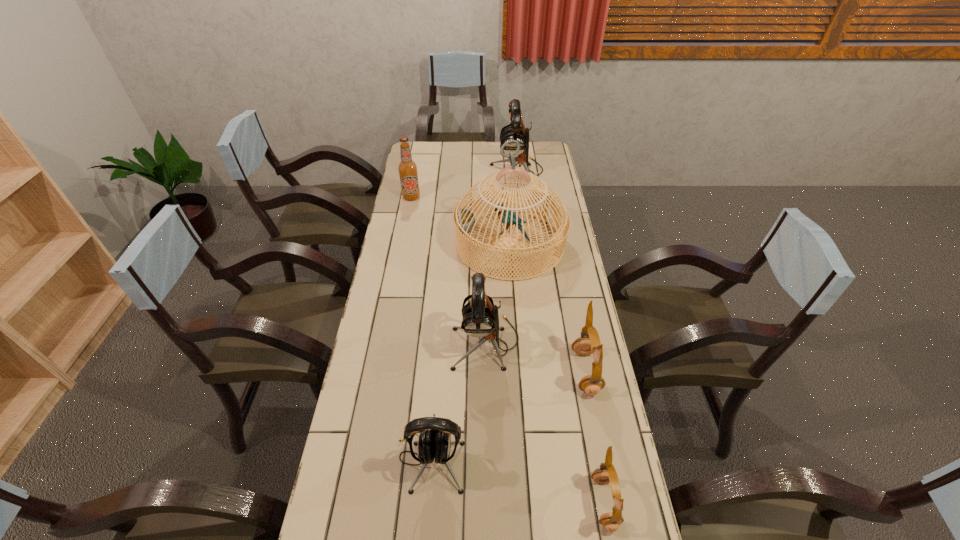
You are a GUI agent. You are given a task and a screenshot of the screen. Output one action in this format:
    pyautogui.click(x=<x>, y=<y>)
    Task: Click on the fifth nearest object
    This screenshot has height=540, width=960.
    Given the screenshot: What is the action you would take?
    pyautogui.click(x=464, y=220)

Locate an element on the screen. This screenshot has width=960, height=540. the tallest object is located at coordinates (464, 220).

At what (x,y) coordinates should I click in order to perform the action: click on the farthest earphone. Please return your answer as a coordinate pair (x, y). Looking at the image, I should click on (515, 130).

Locate an element on the screen. This screenshot has height=540, width=960. the farthest black earphone is located at coordinates (515, 130).

Where is `the second farthest black earphone`? The height and width of the screenshot is (540, 960). the second farthest black earphone is located at coordinates (480, 316).

The image size is (960, 540). Identify the location of the second tallest earphone. (480, 316).

Locate an element on the screen. The image size is (960, 540). the leftmost object is located at coordinates (407, 168).

The image size is (960, 540). I want to click on beer bottle, so click(x=407, y=168).

The height and width of the screenshot is (540, 960). I want to click on the bigger brown earphone, so click(589, 342).

Locate an element on the screen. the smallest black earphone is located at coordinates (435, 443).